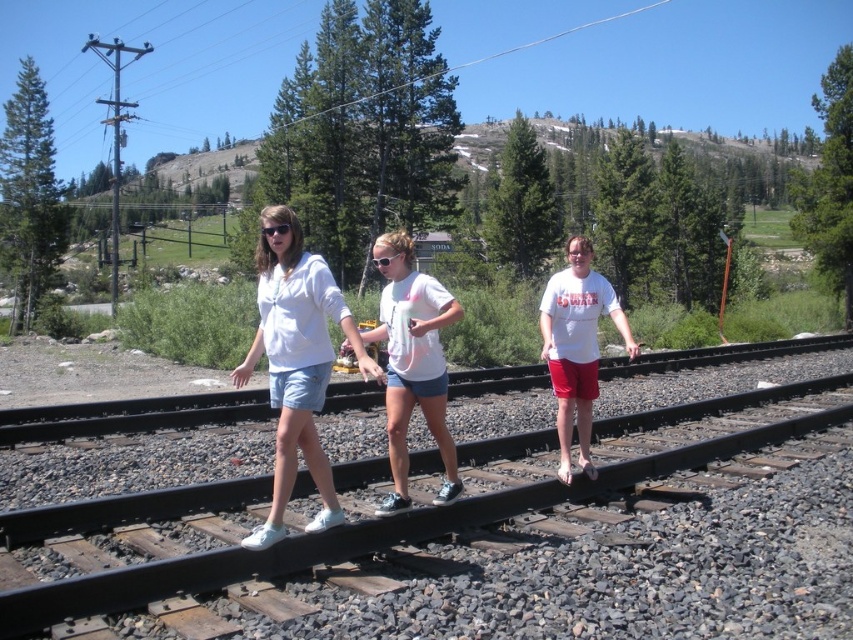
Question: Which object is positioned farthest from the black metal train track at center?

Choices:
 (A) white cotton shorts at center
 (B) black plastic goggles at center
 (C) white cotton t-shirt at center

Answer: (B)

Question: Can you confirm if black metal train track at center is thinner than black plastic goggles at center?

Choices:
 (A) yes
 (B) no

Answer: (B)

Question: Does black metal train track at center appear on the right side of white cotton shorts at center?

Choices:
 (A) no
 (B) yes

Answer: (B)

Question: Among these points, which one is nearest to the camera?

Choices:
 (A) (419, 570)
 (B) (338, 298)
 (C) (393, 260)
 (D) (387, 260)

Answer: (B)

Question: Which object appears closest to the camera in this image?

Choices:
 (A) black metal train track at center
 (B) white cotton shorts at center

Answer: (A)

Question: Is white cotton t-shirt at center positioned before black plastic goggles at center?

Choices:
 (A) no
 (B) yes

Answer: (A)